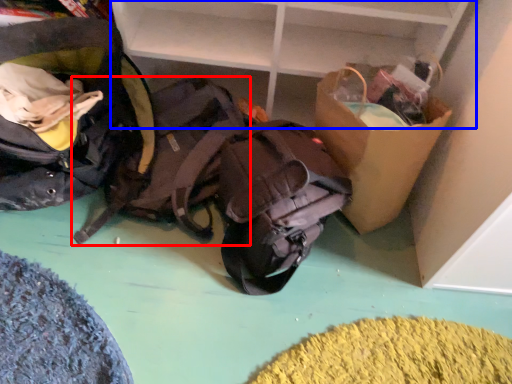
Question: Which object appears farthest to the camera in this image, backpack (highlighted by a red box) or shelf (highlighted by a blue box)?

Choices:
 (A) backpack
 (B) shelf

Answer: (A)